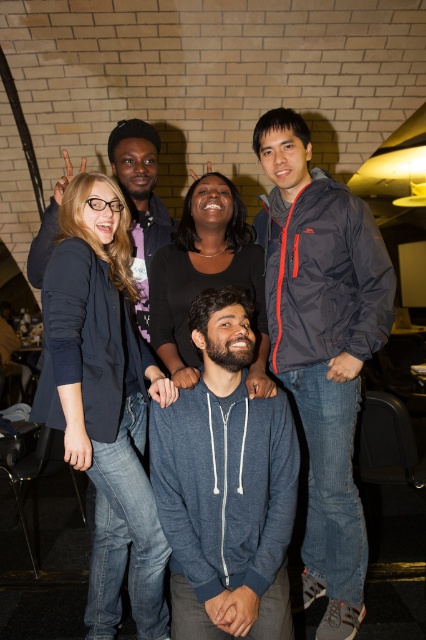
Question: Estimate the real-world distances between objects in this image. Which object is closer to the blue hoodie at center?

Choices:
 (A) dark blue denim jeans at center
 (B) dark blue fleece at center
 (C) navy blue jacket at upper right

Answer: (C)

Question: Which point is farther to the camera?

Choices:
 (A) dark blue denim jeans at center
 (B) blue hoodie at center
 (C) navy blue jacket at upper right
 (D) dark blue fleece at center

Answer: (C)

Question: Does navy blue jacket at upper right have a larger size compared to dark blue fleece at center?

Choices:
 (A) no
 (B) yes

Answer: (B)

Question: In this image, where is dark blue denim jeans at center located relative to blue hoodie at center?

Choices:
 (A) above
 (B) below

Answer: (B)

Question: Which object is farther from the camera taking this photo?

Choices:
 (A) navy blue jacket at upper right
 (B) dark blue denim jeans at center
 (C) dark blue fleece at center

Answer: (A)

Question: Does navy blue jacket at upper right come behind blue hoodie at center?

Choices:
 (A) yes
 (B) no

Answer: (A)